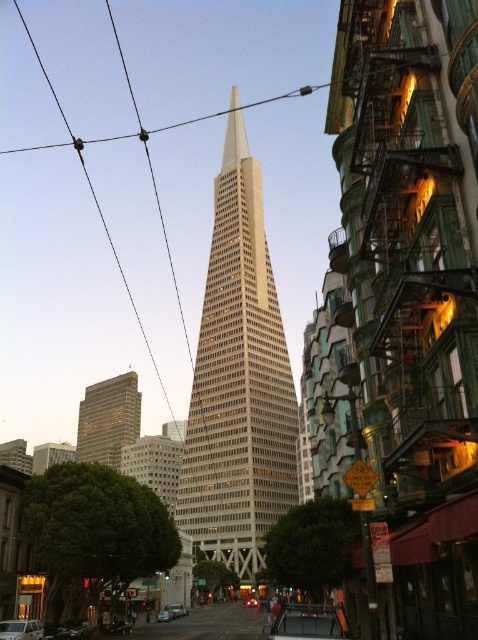
Is beige glass skyscraper at center to the left of metallic silver car at center from the viewer's perspective?

Incorrect, beige glass skyscraper at center is not on the left side of metallic silver car at center.

Does beige glass skyscraper at center appear over metallic silver car at center?

Yes.

Image resolution: width=478 pixels, height=640 pixels. Describe the element at coordinates (239, 380) in the screenshot. I see `beige glass skyscraper at center` at that location.

The width and height of the screenshot is (478, 640). I want to click on beige glass skyscraper at center, so tap(239, 380).

Between point (17, 150) and point (181, 605), which one is positioned behind?

Positioned behind is point (17, 150).

Describe the element at coordinates (97, 195) in the screenshot. I see `metallic wire at upper center` at that location.

In order to click on metallic wire at upper center in this screenshot , I will do `click(97, 195)`.

Is point (160, 620) positioned in front of point (250, 605)?

That is True.

Locate an element on the screen. This screenshot has height=640, width=478. shiny silver car at center is located at coordinates (163, 616).